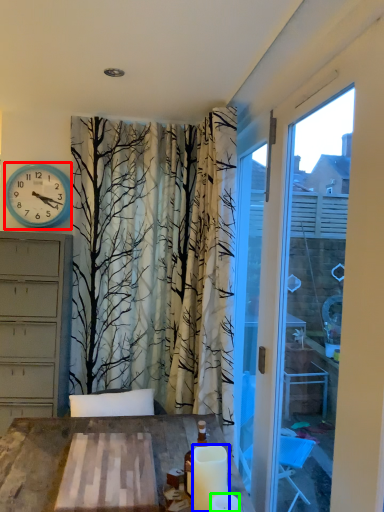
Question: Which object is the farthest from wall clock (highlighted by a red box)? Choose among these: candle (highlighted by a blue box) or candle (highlighted by a green box).

Choices:
 (A) candle
 (B) candle

Answer: (B)